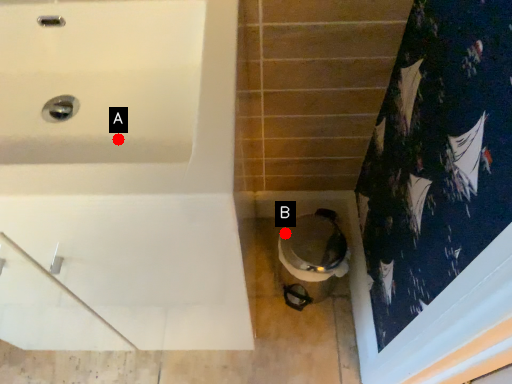
Question: Two points are circled on the image, labeled by A and B beside each circle. Which point is farther to the camera?

Choices:
 (A) A is further
 (B) B is further

Answer: (B)